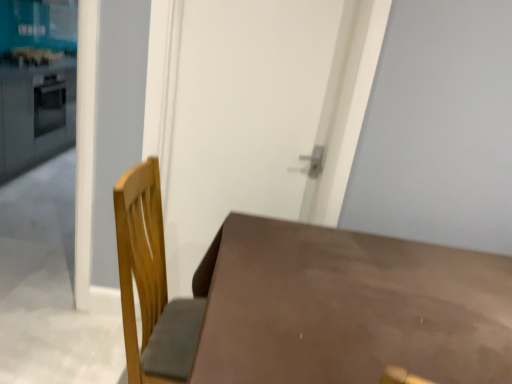
Question: Is matte white counter top at upper left, the 2th counter top in the bottom-to-top sequence, in front of or behind matte brown door at center in the image?

Choices:
 (A) front
 (B) behind

Answer: (B)

Question: Considering the positions of matte white counter top at upper left, the 2th counter top in the bottom-to-top sequence, and matte brown door at center in the image, is matte white counter top at upper left, the 2th counter top in the bottom-to-top sequence, wider or thinner than matte brown door at center?

Choices:
 (A) wide
 (B) thin

Answer: (A)

Question: Estimate the real-world distances between objects in this image. Which object is closer to the matte white counter top at left, positioned as the second counter top in top-to-bottom order?

Choices:
 (A) brown matte table at lower left
 (B) matte white counter top at upper left, which appears as the 1th counter top when viewed from the top
 (C) matte brown door at center

Answer: (B)

Question: Which of these objects is positioned closest to the matte white counter top at upper left, the 2th counter top in the bottom-to-top sequence?

Choices:
 (A) matte white counter top at left, positioned as the second counter top in top-to-bottom order
 (B) matte brown door at center
 (C) brown matte table at lower left

Answer: (A)